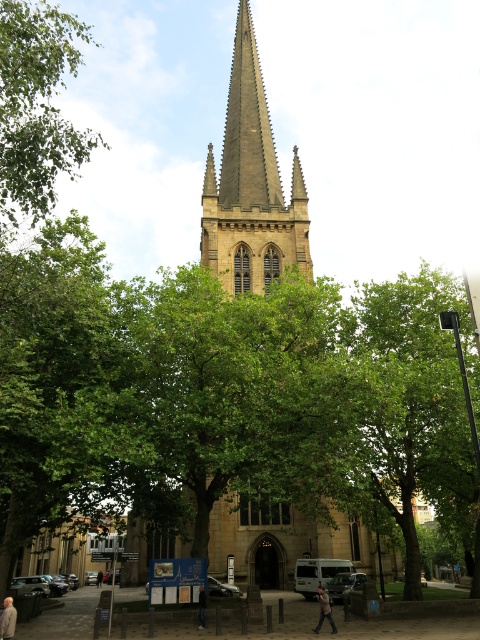
Which is more to the right, brown stone church at center or dark gray fabric jacket at center?

From the viewer's perspective, brown stone church at center appears more on the right side.

Who is taller, brown stone church at center or dark gray fabric jacket at center?

brown stone church at center is taller.

Find the location of `brown stone church at center`. brown stone church at center is located at coordinates (251, 186).

Can you confirm if dark gray jeans at lower center is wider than dark gray fabric jacket at lower left?

Yes, dark gray jeans at lower center is wider than dark gray fabric jacket at lower left.

Can you confirm if dark gray jeans at lower center is bigger than dark gray fabric jacket at lower left?

Correct, dark gray jeans at lower center is larger in size than dark gray fabric jacket at lower left.

Is point (331, 616) closer to viewer compared to point (98, 586)?

Yes, it is.

The height and width of the screenshot is (640, 480). Identify the location of dark gray jeans at lower center. (324, 611).

Which of these two, brown stone church at center or green leafy tree at upper left, stands shorter?

green leafy tree at upper left is shorter.

Who is taller, brown stone church at center or green leafy tree at upper left?

brown stone church at center

Who is more distant from viewer, (260,157) or (44,26)?

Positioned behind is point (260,157).

Where is `brown stone church at center`? brown stone church at center is located at coordinates (251, 186).